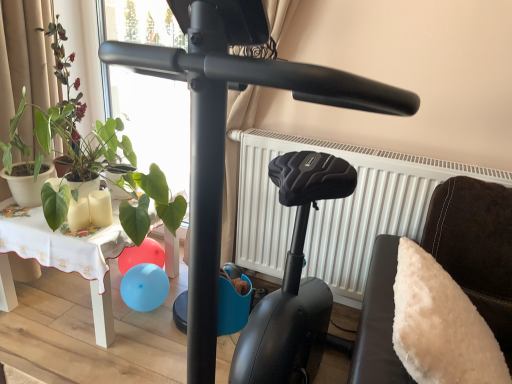
Question: Considering the relative sizes of white fluffy pillow at right and black matte stationary bicycle at center in the image provided, is white fluffy pillow at right smaller than black matte stationary bicycle at center?

Choices:
 (A) yes
 (B) no

Answer: (A)

Question: From a real-world perspective, does white fluffy pillow at right sit lower than black matte stationary bicycle at center?

Choices:
 (A) yes
 (B) no

Answer: (A)

Question: Is white fluffy pillow at right not near black matte stationary bicycle at center?

Choices:
 (A) yes
 (B) no

Answer: (B)

Question: Is white fluffy pillow at right positioned in front of black matte stationary bicycle at center?

Choices:
 (A) yes
 (B) no

Answer: (B)

Question: From a real-world perspective, is white fluffy pillow at right physically above black matte stationary bicycle at center?

Choices:
 (A) yes
 (B) no

Answer: (B)

Question: Does white fluffy pillow at right come behind black matte stationary bicycle at center?

Choices:
 (A) no
 (B) yes

Answer: (B)

Question: From a real-world perspective, is green leafy plant at left, which is counted as the second plant, starting from the top, located higher than white fluffy pillow at right?

Choices:
 (A) no
 (B) yes

Answer: (B)

Question: Can you confirm if green leafy plant at left, which is counted as the second plant, starting from the top, is thinner than white fluffy pillow at right?

Choices:
 (A) no
 (B) yes

Answer: (A)

Question: From the image's perspective, does green leafy plant at left, which is counted as the second plant, starting from the top, appear higher than white fluffy pillow at right?

Choices:
 (A) no
 (B) yes

Answer: (B)

Question: Is green leafy plant at left, the 1th plant from the bottom, smaller than white fluffy pillow at right?

Choices:
 (A) no
 (B) yes

Answer: (A)

Question: Is green leafy plant at left, the 1th plant from the bottom, facing away from white fluffy pillow at right?

Choices:
 (A) no
 (B) yes

Answer: (A)

Question: Is green leafy plant at left, which is counted as the second plant, starting from the top, directly adjacent to white fluffy pillow at right?

Choices:
 (A) yes
 (B) no

Answer: (B)

Question: Is white matte radiator at center thinner than black matte stationary bicycle at center?

Choices:
 (A) no
 (B) yes

Answer: (B)